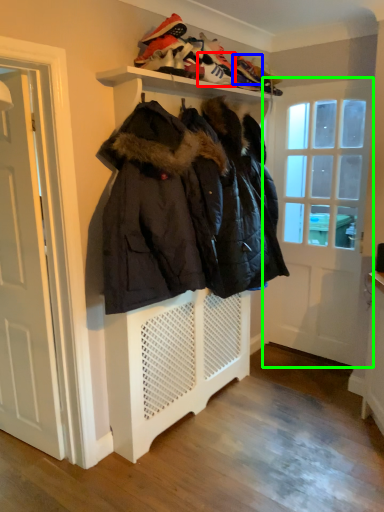
Question: Which object is the closest to the shoe (highlighted by a red box)? Choose among these: shoe (highlighted by a blue box) or door (highlighted by a green box).

Choices:
 (A) shoe
 (B) door

Answer: (A)